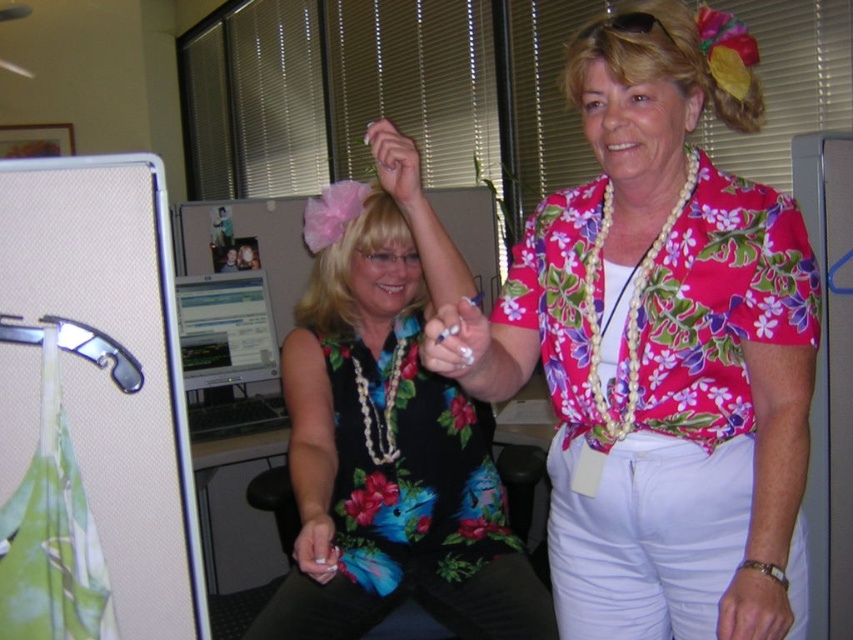
Can you confirm if floral print shirt at center is shorter than matte plastic monitor at center?

No.

Who is higher up, floral print shirt at center or matte plastic monitor at center?

floral print shirt at center is higher up.

Does point (550, 237) come farther from viewer compared to point (219, 429)?

No, it is in front of (219, 429).

Find the location of a particular element. Image resolution: width=853 pixels, height=640 pixels. floral print shirt at center is located at coordinates (660, 348).

Who is higher up, floral fabric dress at center or blonde hair at upper right?

blonde hair at upper right is above.

Can you confirm if floral fabric dress at center is positioned to the left of blonde hair at upper right?

Correct, you'll find floral fabric dress at center to the left of blonde hair at upper right.

Who is more distant from viewer, (457, 554) or (733, 97)?

Point (457, 554)

Locate an element on the screen. Image resolution: width=853 pixels, height=640 pixels. floral fabric dress at center is located at coordinates (392, 438).

Does floral fabric dress at center appear on the right side of matte plastic monitor at center?

Correct, you'll find floral fabric dress at center to the right of matte plastic monitor at center.

Can you confirm if floral fabric dress at center is smaller than matte plastic monitor at center?

Actually, floral fabric dress at center might be larger than matte plastic monitor at center.

I want to click on floral fabric dress at center, so click(392, 438).